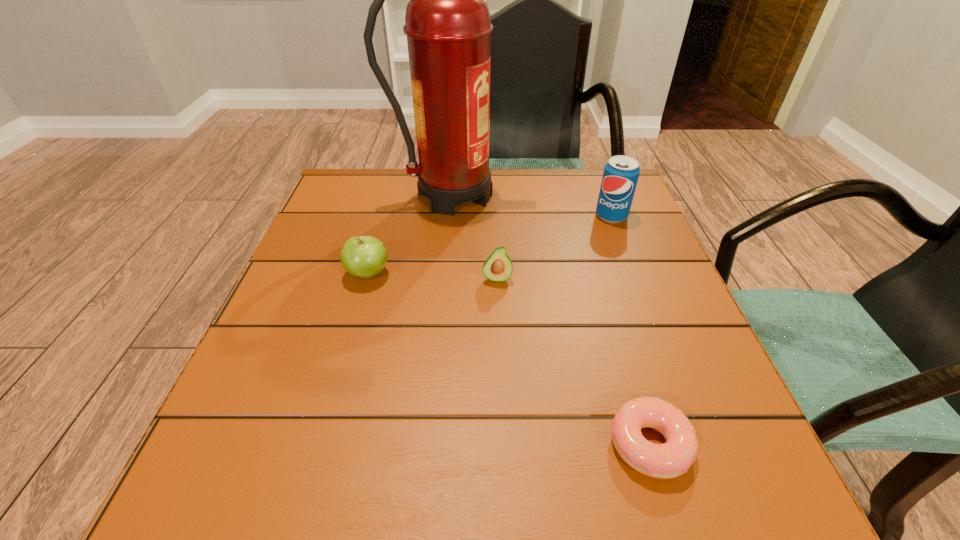
Locate an element on the screen. vacant area in the image that satisfies the following two spatial constraints: 1. on the front-facing side of the fire extinguisher; 2. on the back side of the soda can is located at coordinates (449, 216).

This screenshot has width=960, height=540. Identify the location of vacant space that satisfies the following two spatial constraints: 1. on the back side of the shortest object; 2. on the front-facing side of the fire extinguisher. (575, 195).

This screenshot has width=960, height=540. In order to click on free space that satisfies the following two spatial constraints: 1. on the back side of the soda can; 2. on the front-facing side of the fire extinguisher in this screenshot , I will do `click(603, 195)`.

The width and height of the screenshot is (960, 540). Find the location of `free space that satisfies the following two spatial constraints: 1. on the front-facing side of the tallest object; 2. on the back side of the soda can`. free space that satisfies the following two spatial constraints: 1. on the front-facing side of the tallest object; 2. on the back side of the soda can is located at coordinates (449, 216).

Where is `vacant position in the image that satisfies the following two spatial constraints: 1. on the front-facing side of the tallest object; 2. on the back side of the second tallest object`? This screenshot has width=960, height=540. vacant position in the image that satisfies the following two spatial constraints: 1. on the front-facing side of the tallest object; 2. on the back side of the second tallest object is located at coordinates (449, 216).

I want to click on free spot that satisfies the following two spatial constraints: 1. on the cut side of the avocado; 2. on the left side of the nearest object, so click(x=504, y=444).